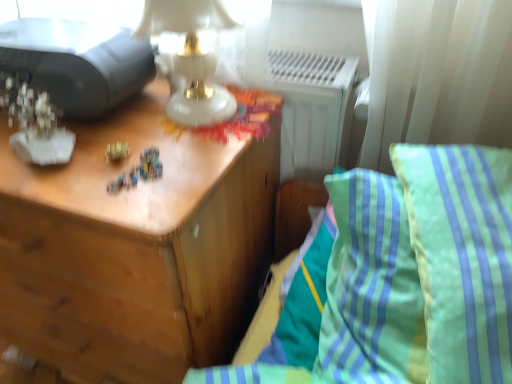
Measure the distance between point (470, 355) and camera.

Point (470, 355) and camera are 18.62 inches apart.

Describe the element at coordinates (135, 249) in the screenshot. The width and height of the screenshot is (512, 384). I see `wooden nightstand at left` at that location.

This screenshot has height=384, width=512. What do you see at coordinates (77, 62) in the screenshot?
I see `matte black printer at upper left` at bounding box center [77, 62].

The image size is (512, 384). Find the location of `green striped pillow at right`. green striped pillow at right is located at coordinates (462, 256).

Considering the relative sizes of green striped pillow at right and matte black printer at upper left in the image provided, is green striped pillow at right bigger than matte black printer at upper left?

Indeed, green striped pillow at right has a larger size compared to matte black printer at upper left.

Between green striped pillow at right and matte black printer at upper left, which one has smaller width?

matte black printer at upper left is thinner.

Is green striped pillow at right directly adjacent to matte black printer at upper left?

No, green striped pillow at right is not in contact with matte black printer at upper left.

Is matte black printer at upper left located within green striped pillow at right?

No, matte black printer at upper left is located outside of green striped pillow at right.

From the image's perspective, is matte black printer at upper left above green striped pillow at right?

Yes, from the image's perspective, matte black printer at upper left is above green striped pillow at right.

Is point (90, 86) less distant than point (389, 204)?

No, (90, 86) is behind (389, 204).

Consider the image. Does matte black printer at upper left appear on the right side of green striped pillow at right?

In fact, matte black printer at upper left is to the left of green striped pillow at right.

Can you confirm if green striped pillow at right is thinner than green striped pillow at right?

In fact, green striped pillow at right might be wider than green striped pillow at right.

Is point (490, 164) farther from camera compared to point (371, 210)?

No.

How different are the orientations of green striped pillow at right and green striped pillow at right in degrees?

11.9 degrees.

Which of these two, green striped pillow at right or green striped pillow at right, is bigger?

green striped pillow at right.

From the image's perspective, is green striped pillow at right located above gold metallic toy at center?

Actually, green striped pillow at right appears below gold metallic toy at center in the image.

Is green striped pillow at right positioned with its back to gold metallic toy at center?

green striped pillow at right does not have its back to gold metallic toy at center.

Which is farther, (398, 364) or (114, 161)?

The point (114, 161) is farther from the camera.

Based on their positions, is green striped pillow at right located to the left or right of gold metallic toy at center?

In the image, green striped pillow at right appears on the right side of gold metallic toy at center.

Considering the positions of objects green striped pillow at right and wooden nightstand at left in the image provided, who is behind, green striped pillow at right or wooden nightstand at left?

wooden nightstand at left is more distant.

Who is bigger, green striped pillow at right or wooden nightstand at left?

wooden nightstand at left is bigger.

Would you say wooden nightstand at left is part of green striped pillow at right's contents?

No, wooden nightstand at left is not surrounded by green striped pillow at right.

How distant is green striped pillow at right from wooden nightstand at left?

A distance of 16.78 inches exists between green striped pillow at right and wooden nightstand at left.

From the image's perspective, is wooden nightstand at left on green striped pillow at right?

No, from the image's perspective, wooden nightstand at left is not over green striped pillow at right.

From a real-world perspective, is wooden nightstand at left positioned above or below green striped pillow at right?

Clearly, from a real-world perspective, wooden nightstand at left is below green striped pillow at right.

Consider the image. Between wooden nightstand at left and green striped pillow at right, which one has smaller width?

green striped pillow at right.

Is wooden nightstand at left oriented towards green striped pillow at right?

No, wooden nightstand at left is not aimed at green striped pillow at right.

From the image's perspective, is wooden nightstand at left located above or below gold metallic toy at center?

wooden nightstand at left is below gold metallic toy at center.

Are wooden nightstand at left and gold metallic toy at center far apart?

No, wooden nightstand at left is in close proximity to gold metallic toy at center.

In terms of height, does wooden nightstand at left look taller or shorter compared to gold metallic toy at center?

Clearly, wooden nightstand at left is taller compared to gold metallic toy at center.

Image resolution: width=512 pixels, height=384 pixels. What are the coordinates of `furniture that is in front of the matte black printer at upper left` in the screenshot? It's located at (413, 273).

The height and width of the screenshot is (384, 512). What are the coordinates of `printer on the left of green striped pillow at right` in the screenshot? It's located at (77, 62).

From the picture: Estimate the real-world distances between objects in this image. Which object is closer to gold metallic toy at center, matte black printer at upper left or green striped pillow at right?

The object closer to gold metallic toy at center is matte black printer at upper left.

Which object lies nearer to the anchor point green striped pillow at right, matte black printer at upper left or green striped pillow at right?

The object closer to green striped pillow at right is green striped pillow at right.

Estimate the real-world distances between objects in this image. Which object is further from green striped pillow at right, gold metallic toy at center or green striped pillow at right?

Among the two, gold metallic toy at center is located further to green striped pillow at right.

From the image, which object appears to be nearer to wooden nightstand at left, green striped pillow at right or green striped pillow at right?

green striped pillow at right is positioned closer to the anchor wooden nightstand at left.

In the scene shown: Estimate the real-world distances between objects in this image. Which object is further from gold metallic toy at center, wooden nightstand at left or matte black printer at upper left?

Among the two, wooden nightstand at left is located further to gold metallic toy at center.

Estimate the real-world distances between objects in this image. Which object is closer to gold metallic toy at center, matte black printer at upper left or wooden nightstand at left?

matte black printer at upper left is positioned closer to the anchor gold metallic toy at center.

Looking at the image, which one is located closer to wooden nightstand at left, matte black printer at upper left or green striped pillow at right?

matte black printer at upper left lies closer to wooden nightstand at left than the other object.

Which object lies nearer to the anchor point gold metallic toy at center, green striped pillow at right or green striped pillow at right?

green striped pillow at right is positioned closer to the anchor gold metallic toy at center.

Identify the location of toy located between wooden nightstand at left and green striped pillow at right in the left-right direction. The width and height of the screenshot is (512, 384). (117, 152).

At what (x,y) coordinates should I click in order to perform the action: click on furniture between matte black printer at upper left and green striped pillow at right from left to right. Please return your answer as a coordinate pair (x, y). Looking at the image, I should click on (413, 273).

Identify the location of toy between matte black printer at upper left and wooden nightstand at left from top to bottom. The width and height of the screenshot is (512, 384). (117, 152).

This screenshot has height=384, width=512. Identify the location of toy between matte black printer at upper left and green striped pillow at right from left to right. pyautogui.click(x=117, y=152).